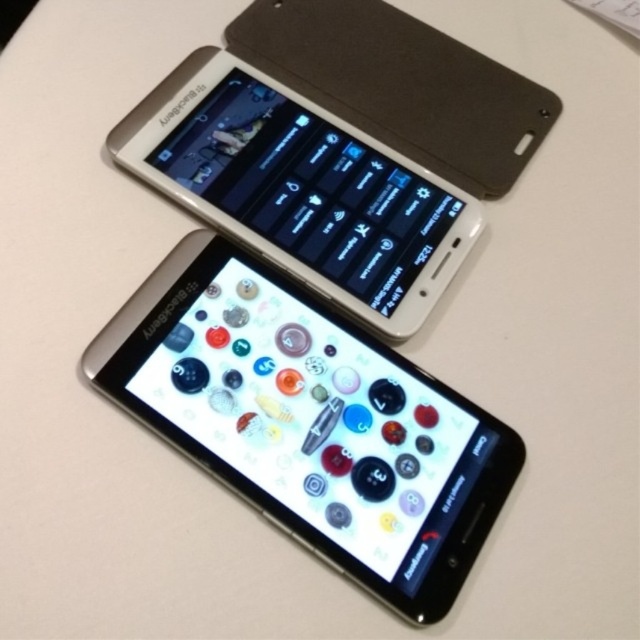
Who is lower down, silver metallic smartphone at center or matte black smartphone at upper center?

silver metallic smartphone at center

Is point (278, 403) positioned in front of point (404, 106)?

Yes, it is.

Looking at this image, who is more forward, (256, 428) or (387, 109)?

Point (256, 428)

Locate an element on the screen. The height and width of the screenshot is (640, 640). silver metallic smartphone at center is located at coordinates (308, 420).

Locate an element on the screen. The height and width of the screenshot is (640, 640). satin silver phone at upper center is located at coordinates (300, 188).

Does satin silver phone at upper center have a lesser height compared to matte black smartphone at upper center?

Incorrect, satin silver phone at upper center's height does not fall short of matte black smartphone at upper center's.

Is point (353, 288) positioned behind point (513, 131)?

No, it is in front of (513, 131).

At what (x,y) coordinates should I click in order to perform the action: click on satin silver phone at upper center. Please return your answer as a coordinate pair (x, y). Looking at the image, I should click on (300, 188).

Can you confirm if silver metallic smartphone at center is positioned above satin silver phone at upper center?

Actually, silver metallic smartphone at center is below satin silver phone at upper center.

Does silver metallic smartphone at center have a greater width compared to satin silver phone at upper center?

Correct, the width of silver metallic smartphone at center exceeds that of satin silver phone at upper center.

Which is in front, point (182, 387) or point (358, 177)?

Point (182, 387)

Locate an element on the screen. silver metallic smartphone at center is located at coordinates (308, 420).